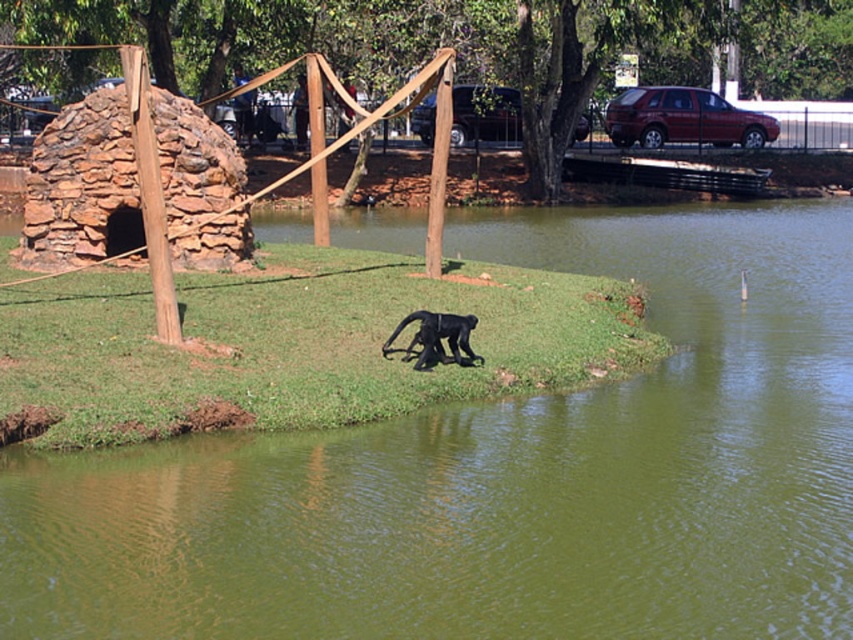
Question: Which of the following is the farthest from the observer?

Choices:
 (A) dark gray fur monkey at center
 (B) green grassy island at center

Answer: (A)

Question: Can you confirm if green grassy island at center is bigger than green grass at center?

Choices:
 (A) no
 (B) yes

Answer: (B)

Question: From the image, what is the correct spatial relationship of green grassy island at center in relation to green grass at center?

Choices:
 (A) below
 (B) above

Answer: (A)

Question: Which of the following is the farthest from the observer?

Choices:
 (A) (415, 340)
 (B) (318, 380)
 (C) (254, 456)

Answer: (A)

Question: Which point is closer to the camera taking this photo?

Choices:
 (A) (358, 310)
 (B) (405, 353)

Answer: (B)

Question: Can you confirm if green grass at center is wider than dark gray fur monkey at center?

Choices:
 (A) yes
 (B) no

Answer: (A)